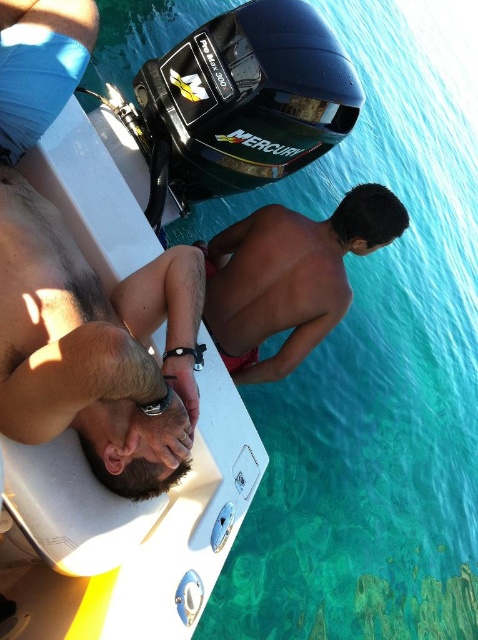
From the picture: Between black plastic motor at upper center and smooth skin torso at center, which one appears on the right side from the viewer's perspective?

smooth skin torso at center

Who is lower down, black plastic motor at upper center or smooth skin torso at center?

smooth skin torso at center is lower down.

Does point (246, 32) come farther from viewer compared to point (389, 202)?

No.

The height and width of the screenshot is (640, 478). I want to click on black plastic motor at upper center, so tap(239, 102).

Can you confirm if white plastic boat at upper center is smaller than smooth skin man at lower left?

Incorrect, white plastic boat at upper center is not smaller in size than smooth skin man at lower left.

How much distance is there between white plastic boat at upper center and smooth skin man at lower left?

The distance of white plastic boat at upper center from smooth skin man at lower left is 2.17 inches.

Does point (35, 371) come behind point (177, 380)?

No, (35, 371) is closer to viewer.

Where is `white plastic boat at upper center`? white plastic boat at upper center is located at coordinates (85, 289).

Can you confirm if white plastic boat at upper center is positioned to the right of smooth skin torso at center?

No, white plastic boat at upper center is not to the right of smooth skin torso at center.

Can you confirm if white plastic boat at upper center is wider than smooth skin torso at center?

No, white plastic boat at upper center is not wider than smooth skin torso at center.

This screenshot has height=640, width=478. Identify the location of white plastic boat at upper center. (85, 289).